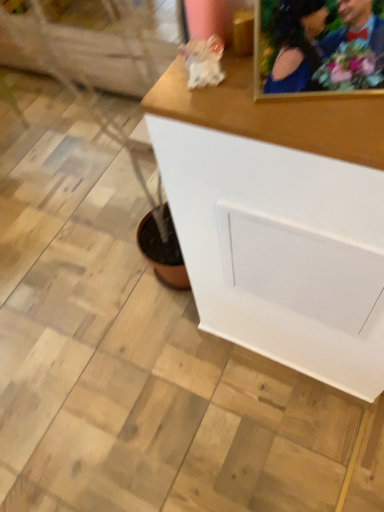
Question: From a real-world perspective, is white matte cabinet at center above or below gold-framed photo at upper right?

Choices:
 (A) above
 (B) below

Answer: (B)

Question: Is white matte cabinet at center bigger or smaller than gold-framed photo at upper right?

Choices:
 (A) big
 (B) small

Answer: (A)

Question: From their relative heights in the image, would you say white matte cabinet at center is taller or shorter than gold-framed photo at upper right?

Choices:
 (A) short
 (B) tall

Answer: (B)

Question: Looking at their shapes, would you say gold-framed photo at upper right is wider or thinner than white matte cabinet at center?

Choices:
 (A) wide
 (B) thin

Answer: (B)

Question: From a real-world perspective, is gold-framed photo at upper right above or below white matte cabinet at center?

Choices:
 (A) below
 (B) above

Answer: (B)

Question: From the image's perspective, is gold-framed photo at upper right located above or below white matte cabinet at center?

Choices:
 (A) above
 (B) below

Answer: (A)

Question: Looking at the image, does gold-framed photo at upper right seem bigger or smaller compared to white matte cabinet at center?

Choices:
 (A) big
 (B) small

Answer: (B)